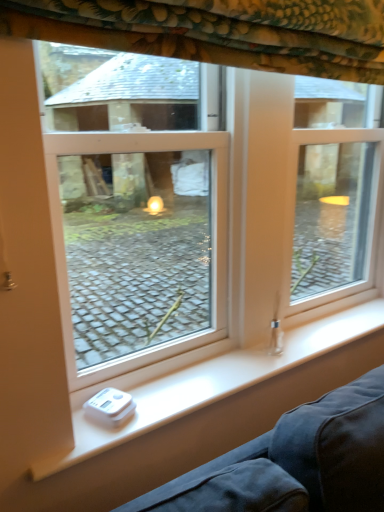
Identify the location of free space above white plastic scale at lower left (from a real-world perspective). (263, 358).